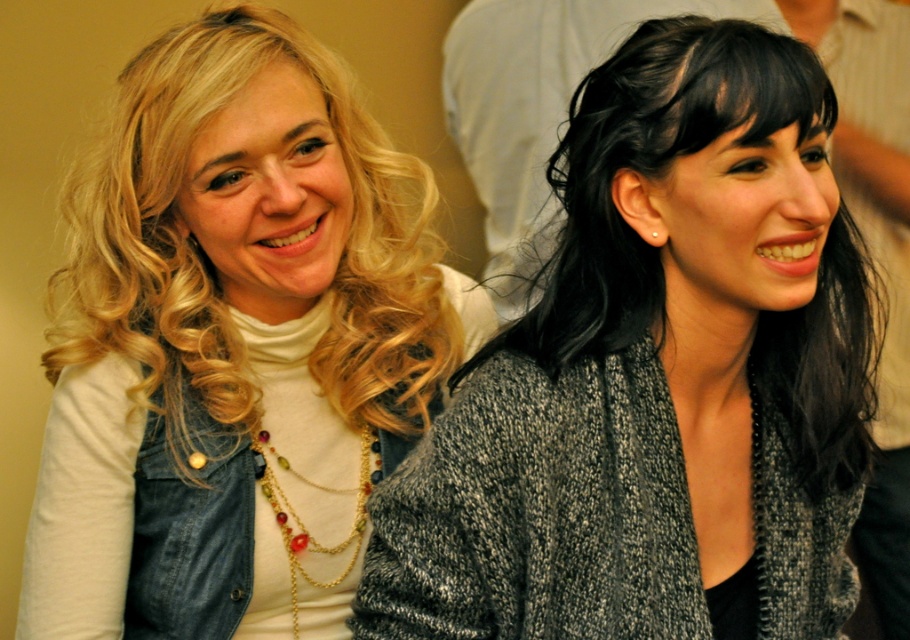
Question: Is gray knitted sweater at center smaller than blonde curly hair at left?

Choices:
 (A) yes
 (B) no

Answer: (A)

Question: Can you confirm if gray knitted sweater at center is positioned above blonde curly hair at left?

Choices:
 (A) yes
 (B) no

Answer: (B)

Question: Which object appears closest to the camera in this image?

Choices:
 (A) gray knitted sweater at center
 (B) blonde curly hair at left

Answer: (A)

Question: Which object is closer to the camera taking this photo?

Choices:
 (A) gray knitted sweater at center
 (B) blonde curly hair at left

Answer: (A)

Question: Does gray knitted sweater at center appear on the left side of blonde curly hair at left?

Choices:
 (A) yes
 (B) no

Answer: (B)

Question: Which object is farther from the camera taking this photo?

Choices:
 (A) gray knitted sweater at center
 (B) blonde curly hair at left

Answer: (B)